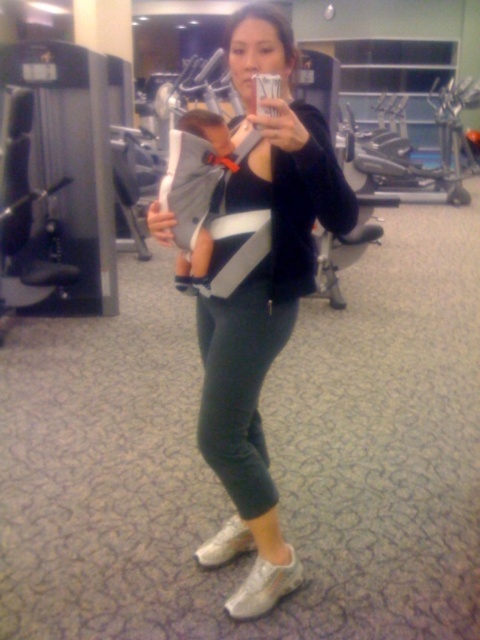
You are a fitness instructor observing the woman in the gym. You need to check the distance between the black matte baby carrier at center and the dark green leggings at center to ensure safety standards. According to the safety guidelines, the distance between these two items must be at least 4 inches. Is the current distance compliant with the safety standards?

The black matte baby carrier at center and dark green leggings at center are 3.62 inches apart, which is less than the required 4 inches. Therefore, the current distance does not comply with the safety standards.

You are a gym trainer who needs to place a new equipment in the gym. The gym has a coordinate system where the bottom left corner is the origin. The existing equipment is located at point (263,300). Where should you place the new equipment so it doesn not interfere with the black matte baby carrier at center?

The point (263,300) corresponds to the black matte baby carrier at center, so the new equipment should be placed away from that coordinate to avoid interference.

You are a fitness instructor observing the woman in the gym. You need to determine which item is larger between the black matte baby carrier at center and the dark green leggings at center. Based on the scene, which one is bigger?

The black matte baby carrier at center is bigger than the dark green leggings at center.